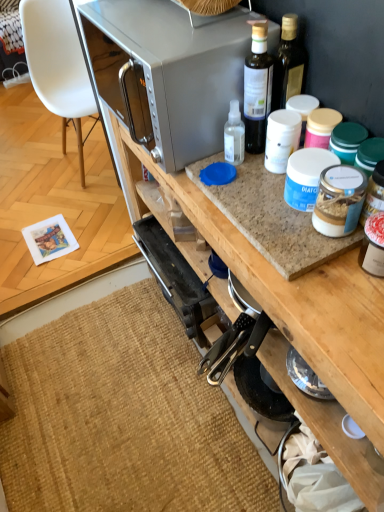
The height and width of the screenshot is (512, 384). Identify the location of free spot above burlap mat at lower left (from a real-world perspective). (110, 406).